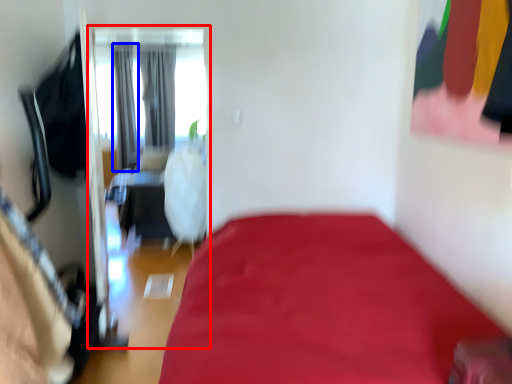
Question: Which object appears farthest to the camera in this image, screen door (highlighted by a red box) or curtain (highlighted by a blue box)?

Choices:
 (A) screen door
 (B) curtain

Answer: (B)